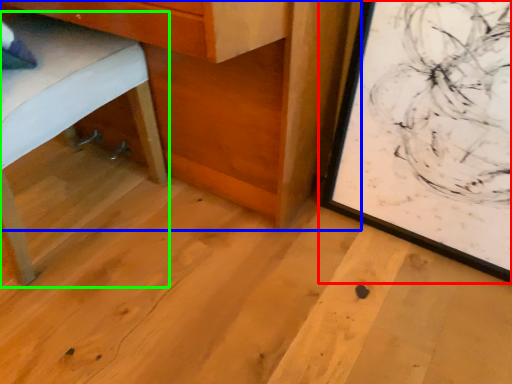
Question: Estimate the real-world distances between objects in this image. Which object is closer to picture frame (highlighted by a red box), table (highlighted by a blue box) or furniture (highlighted by a green box)?

Choices:
 (A) table
 (B) furniture

Answer: (A)